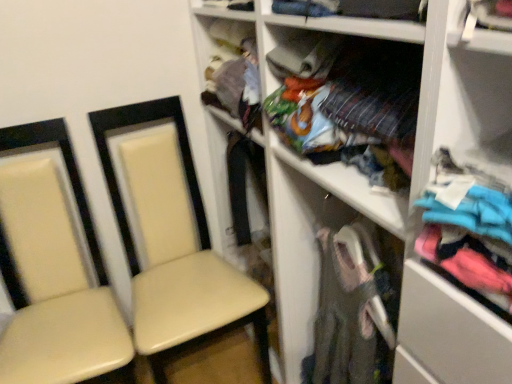
Question: Considering the positions of textured fabric clothing at upper center and turquoise fabric shirt at right, which is counted as the second clothing, starting from the back, in the image, is textured fabric clothing at upper center taller or shorter than turquoise fabric shirt at right, which is counted as the second clothing, starting from the back,?

Choices:
 (A) short
 (B) tall

Answer: (B)

Question: Visually, is textured fabric clothing at upper center positioned to the left or to the right of turquoise fabric shirt at right, which is counted as the second clothing, starting from the back?

Choices:
 (A) right
 (B) left

Answer: (B)

Question: Which object is the closest to the turquoise fabric shirt at right, the first clothing positioned from the front?

Choices:
 (A) matte white shelf at center
 (B) beige leather chair at left, which is the second chair from left to right
 (C) beige leather chair at left, acting as the 2th chair starting from the right
 (D) textured fabric clothing at upper center
 (E) multicolored fabric at center, acting as the 2th clothing starting from the front

Answer: (A)

Question: Which object is positioned farthest from the turquoise fabric shirt at right, which is counted as the second clothing, starting from the back?

Choices:
 (A) matte white shelf at center
 (B) multicolored fabric at center, acting as the 1th clothing starting from the back
 (C) textured fabric clothing at upper center
 (D) beige leather chair at left, which is the second chair from left to right
 (E) beige leather chair at left, the 1th chair positioned from the left

Answer: (E)